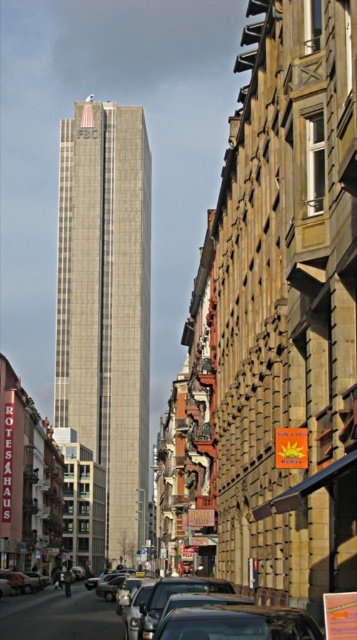
You are a tourist standing on the street looking at the beige stone skyscraper at center and the shiny silver car at lower center. Which object takes up more space in the image?

The beige stone skyscraper at center takes up more space in the image than the shiny silver car at lower center because it is bigger.

You are a pedestrian standing on the street in front of the beige stone skyscraper at center and the shiny silver car at lower center. Which object is positioned higher from the ground?

The beige stone skyscraper at center is located above the shiny silver car at lower center, so it is positioned higher from the ground.